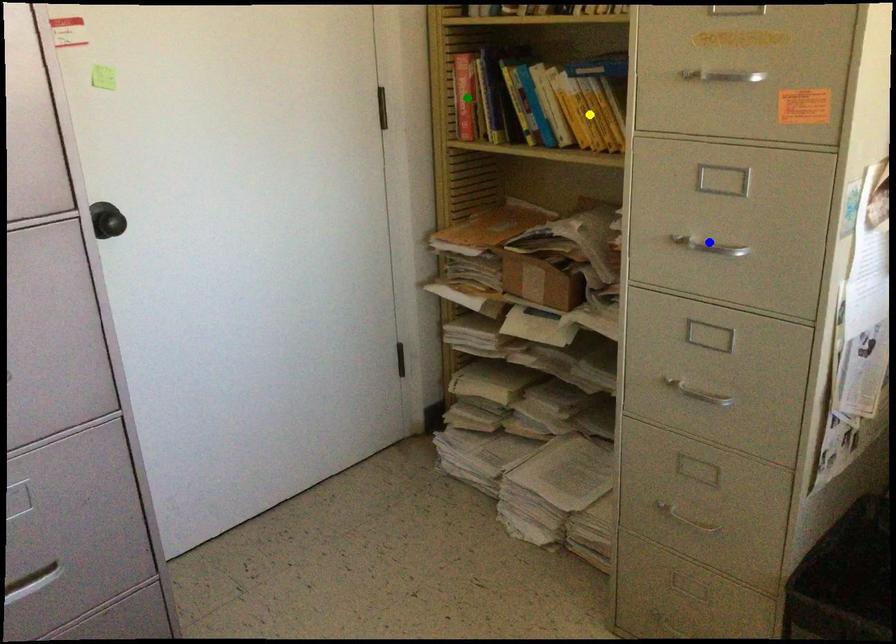
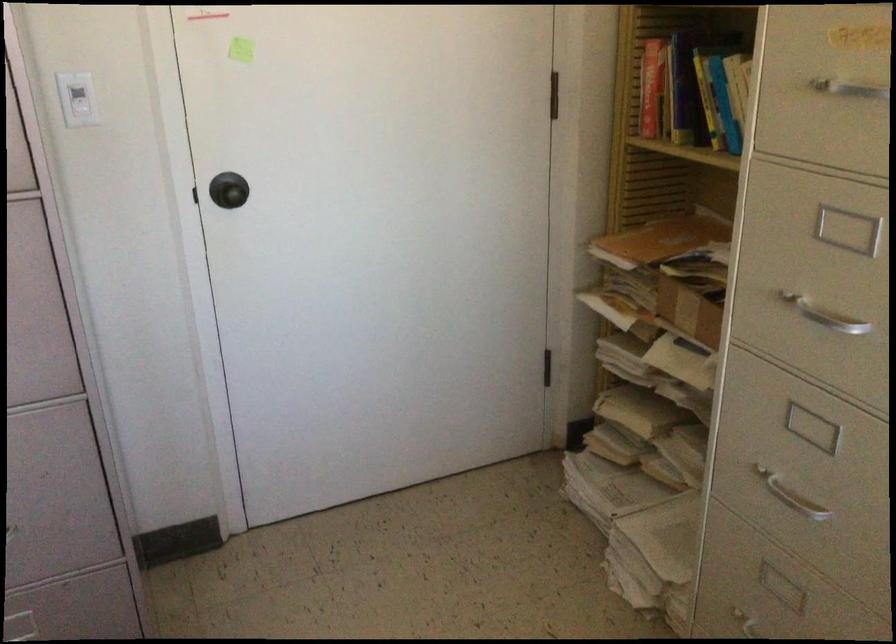
I am providing you with two images of the same scene from different viewpoints. Three points are marked in image1. Which point corresponds to a part or object that is occluded in image2?In image1, three points are marked. Which of them correspond to a part or object that is occluded in image2?Among the three points shown in image1, which one corresponds to a part or object that is no longer visible due to occlusion in image2?

yellow point